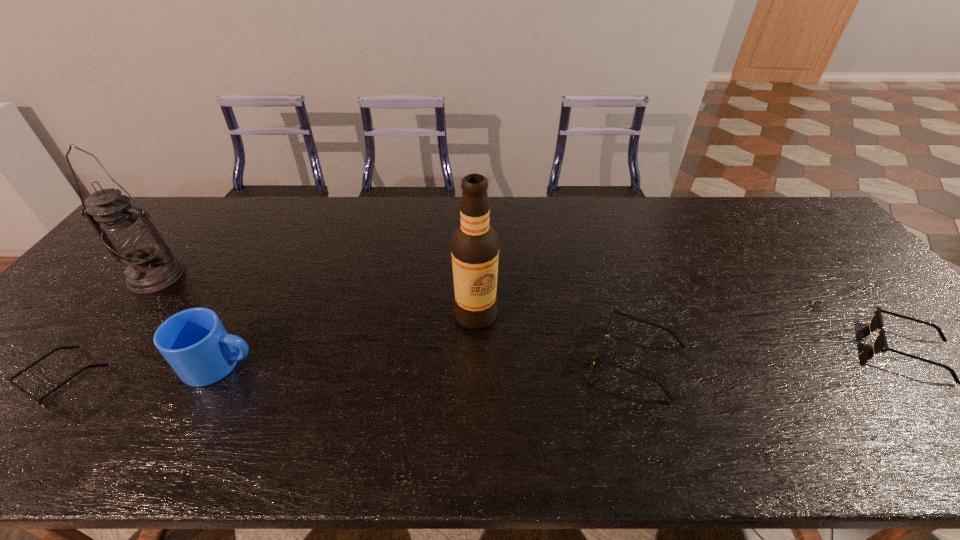
This screenshot has width=960, height=540. I want to click on free space located on the side of the fourth object from right to left with the handle, so click(317, 364).

The width and height of the screenshot is (960, 540). In order to click on sunglasses located at the near edge in this screenshot , I will do `click(661, 385)`.

In order to click on mug that is at the near edge in this screenshot , I will do (194, 342).

Identify the location of object that is at the left edge. This screenshot has width=960, height=540. coord(127,233).

Locate an element on the screen. This screenshot has height=540, width=960. free space at the far edge of the desktop is located at coordinates (757, 228).

In the image, there is a desktop. Where is `free region at the far right corner`? This screenshot has width=960, height=540. free region at the far right corner is located at coordinates (780, 211).

Where is `empty space that is in between the second sunglasses from right to left and the third object from right to left`? empty space that is in between the second sunglasses from right to left and the third object from right to left is located at coordinates (557, 337).

Identify the location of free space between the fourth shortest object and the fifth object from left to right. (429, 362).

Locate an element on the screen. This screenshot has height=540, width=960. unoccupied position between the alcohol and the third object from left to right is located at coordinates (348, 340).

At what (x,y) coordinates should I click in order to perform the action: click on free point between the alcohol and the fifth object from left to right. Please return your answer as a coordinate pair (x, y). Looking at the image, I should click on (557, 337).